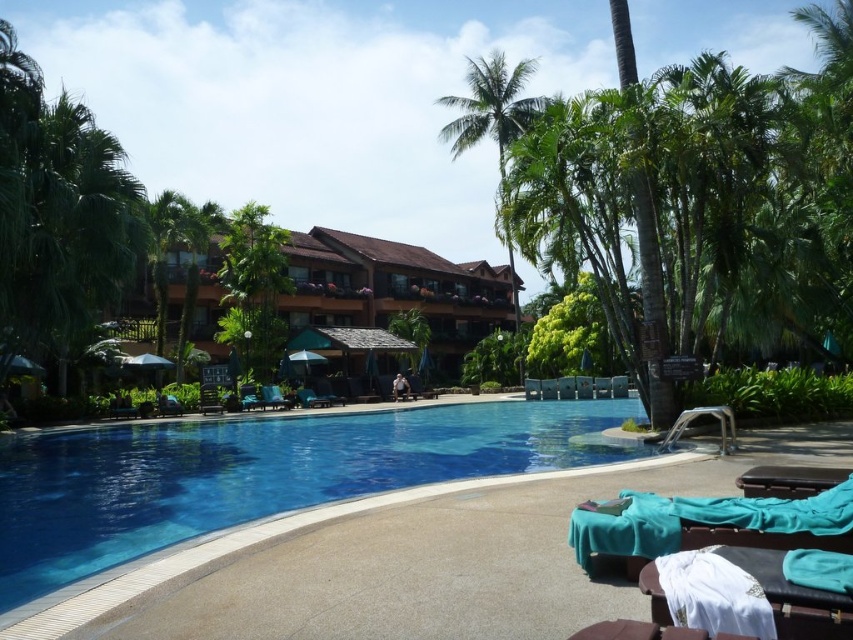
Question: Does green leafy palm tree at upper left appear on the right side of blue fabric beach chair at center?

Choices:
 (A) no
 (B) yes

Answer: (A)

Question: Which point is farther to the camera?

Choices:
 (A) (474, 128)
 (B) (367, 388)

Answer: (A)

Question: Estimate the real-world distances between objects in this image. Which object is closer to the teal fabric beach chair at center?

Choices:
 (A) blue fabric beach chair at center
 (B) matte blue lounge chair at center
 (C) metallic silver beach chair at lower right

Answer: (A)

Question: From the image, what is the correct spatial relationship of brown wooden hotel at center in relation to green leafy palm tree at upper left?

Choices:
 (A) right
 (B) left

Answer: (A)

Question: Does matte blue lounge chair at center lie in front of teal fabric beach chair at center?

Choices:
 (A) no
 (B) yes

Answer: (A)

Question: Which object is the closest to the wooden beach chair at center?

Choices:
 (A) teal fabric beach chair at center
 (B) metallic silver beach chair at lower right
 (C) green fabric lounge chair at center

Answer: (A)